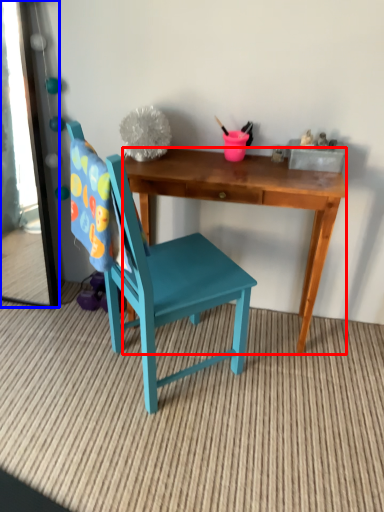
Question: Which object appears closest to the camera in this image, desk (highlighted by a red box) or mirror (highlighted by a blue box)?

Choices:
 (A) desk
 (B) mirror

Answer: (A)